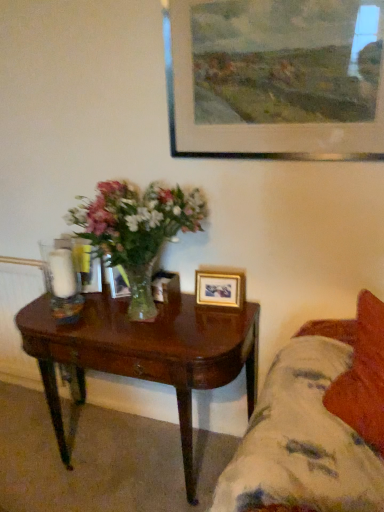
Question: Would you say fluffy fabric couch at lower right is outside wooden picture frame at upper center, acting as the first picture frame starting from the top?

Choices:
 (A) no
 (B) yes

Answer: (B)

Question: From the image's perspective, is fluffy fabric couch at lower right below wooden picture frame at upper center, positioned as the third picture frame in back-to-front order?

Choices:
 (A) yes
 (B) no

Answer: (A)

Question: From a real-world perspective, is fluffy fabric couch at lower right under wooden picture frame at upper center, which is the 1th picture frame in front-to-back order?

Choices:
 (A) yes
 (B) no

Answer: (A)

Question: From the image's perspective, is fluffy fabric couch at lower right located above wooden picture frame at upper center, acting as the first picture frame starting from the top?

Choices:
 (A) yes
 (B) no

Answer: (B)

Question: Can you confirm if fluffy fabric couch at lower right is thinner than wooden picture frame at upper center, which is the third picture frame from bottom to top?

Choices:
 (A) no
 (B) yes

Answer: (A)

Question: Is wooden picture frame at upper center, which is the 1th picture frame in front-to-back order, taller or shorter than gold metallic picture frame at lower right, placed as the second picture frame when sorted from bottom to top?

Choices:
 (A) tall
 (B) short

Answer: (A)

Question: In terms of size, does wooden picture frame at upper center, positioned as the third picture frame in back-to-front order, appear bigger or smaller than gold metallic picture frame at lower right, which is counted as the second picture frame, starting from the top?

Choices:
 (A) small
 (B) big

Answer: (B)

Question: Based on their positions, is wooden picture frame at upper center, positioned as the third picture frame in back-to-front order, located to the left or right of gold metallic picture frame at lower right, positioned as the second picture frame in back-to-front order?

Choices:
 (A) left
 (B) right

Answer: (B)

Question: Is point (271, 53) closer or farther from the camera than point (243, 290)?

Choices:
 (A) closer
 (B) farther

Answer: (A)

Question: Is dark wood coffee table at lower left wider or thinner than fluffy fabric couch at lower right?

Choices:
 (A) thin
 (B) wide

Answer: (A)

Question: From the image's perspective, is dark wood coffee table at lower left above or below fluffy fabric couch at lower right?

Choices:
 (A) above
 (B) below

Answer: (B)

Question: Is point (183, 415) closer or farther from the camera than point (263, 389)?

Choices:
 (A) farther
 (B) closer

Answer: (B)

Question: From a real-world perspective, is dark wood coffee table at lower left positioned above or below fluffy fabric couch at lower right?

Choices:
 (A) above
 (B) below

Answer: (B)

Question: In terms of size, does wooden picture frame at center, which is counted as the first picture frame, starting from the back, appear bigger or smaller than gold metallic picture frame at lower right, which is counted as the second picture frame, starting from the top?

Choices:
 (A) big
 (B) small

Answer: (A)

Question: Choose the correct answer: Is wooden picture frame at center, the first picture frame positioned from the bottom, inside gold metallic picture frame at lower right, positioned as the second picture frame in back-to-front order, or outside it?

Choices:
 (A) inside
 (B) outside

Answer: (B)